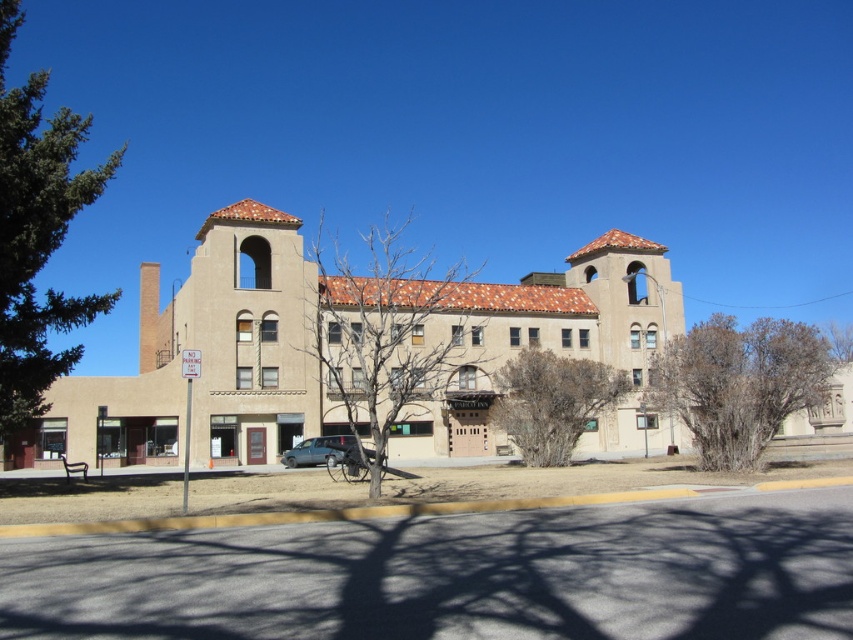
You are standing in front of the beige stucco church at center and want to walk to the green leafy tree at left. Which direction should you face to walk directly towards it?

You should face towards the left to walk directly towards the green leafy tree at left because the beige stucco church at center is closer to the viewer than the green leafy tree at left, indicating the tree is further away to the left side.

You are a delivery person who needs to park your metallic silver car at center as close as possible to the beige stucco church at center without violating the parking rules. The parking zone allows parking within 30 feet of the church. Can you park your car there?

The beige stucco church at center is 32.05 feet from the metallic silver car at center. Since the parking zone allows parking within 30 feet, the car is currently 2.05 feet beyond the allowed distance. You cannot park there without violating the parking rules.

You are standing in front of the building and want to take a photo of the bare branches at center. If your camera can focus on objects up to 15 meters away, will you need to move closer to capture a clear image?

The distance between the bare branches at center and the camera is 15.79 meters. Since your camera can only focus up to 15 meters, you need to move closer to ensure the bare branches at center are within the focus range.